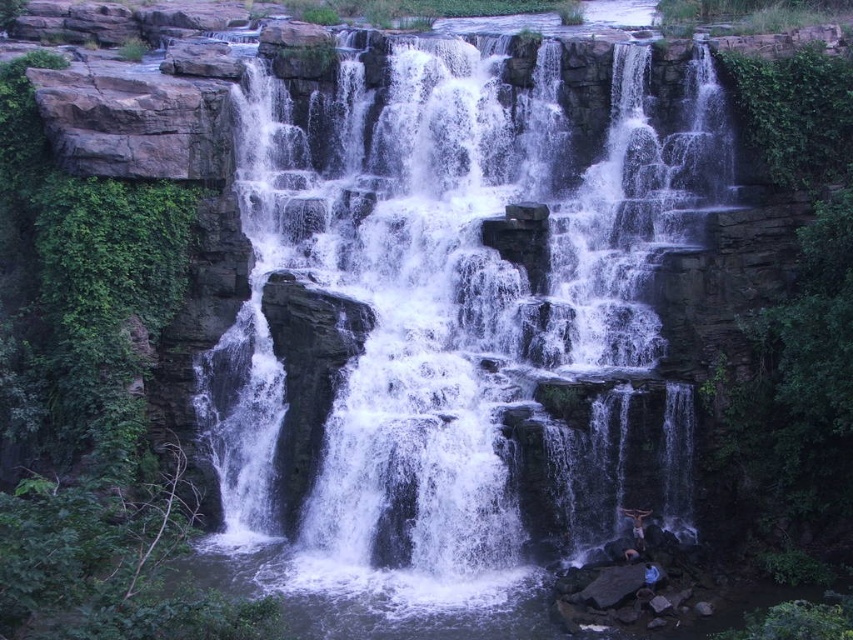
Question: Does white frothy water at center have a lesser width compared to dark skin person at lower right?

Choices:
 (A) yes
 (B) no

Answer: (B)

Question: Which object appears closest to the camera in this image?

Choices:
 (A) dark skin person at lower right
 (B) blue fabric person at lower right
 (C) white frothy water at center

Answer: (B)

Question: Which object is the closest to the dark skin person at lower right?

Choices:
 (A) white frothy water at center
 (B) blue fabric person at lower right

Answer: (B)

Question: In this image, where is white frothy water at center located relative to dark skin person at lower right?

Choices:
 (A) above
 (B) below

Answer: (A)

Question: Which of the following is the farthest from the observer?

Choices:
 (A) (456, 72)
 (B) (642, 515)

Answer: (A)

Question: Can you confirm if white frothy water at center is smaller than blue fabric person at lower right?

Choices:
 (A) no
 (B) yes

Answer: (A)